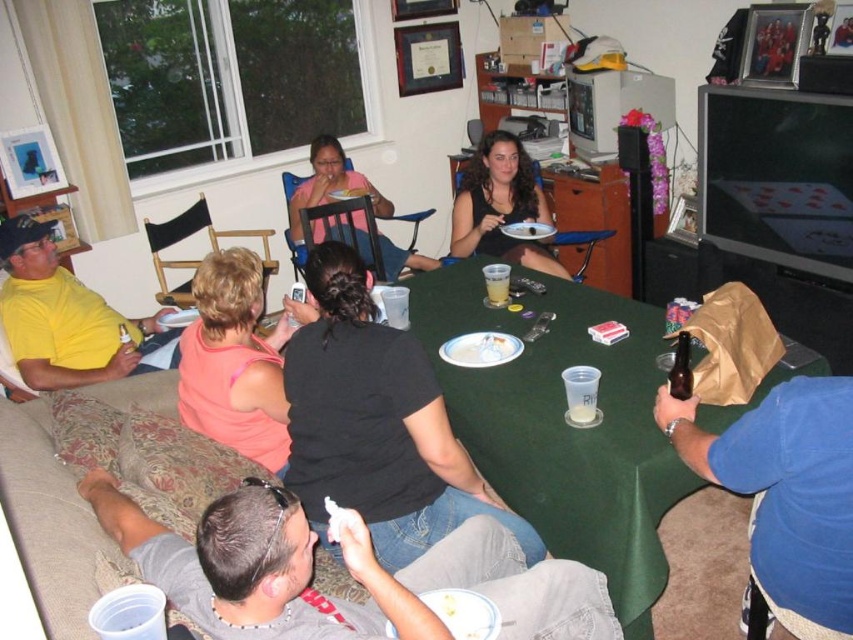
Question: Considering the real-world distances, which object is farthest from the green fabric table at center?

Choices:
 (A) black matte shirt at center
 (B) blue fabric bag at lower right
 (C) pink matte shirt at upper center
 (D) yellow matte shirt at left

Answer: (C)

Question: Is black matte shirt at center to the left of blue fabric bag at lower right from the viewer's perspective?

Choices:
 (A) no
 (B) yes

Answer: (B)

Question: Which of the following is the farthest from the observer?

Choices:
 (A) blue fabric bag at lower right
 (B) yellow matte shirt at left
 (C) pink fabric shirt at center
 (D) green fabric table at center

Answer: (B)

Question: Can you confirm if green fabric table at center is positioned below black fabric shirt at center?

Choices:
 (A) yes
 (B) no

Answer: (A)

Question: Can you confirm if green fabric table at center is bigger than pink fabric shirt at center?

Choices:
 (A) no
 (B) yes

Answer: (B)

Question: Which point is farther from the camera taking this photo?

Choices:
 (A) tap(202, 289)
 (B) tap(456, 268)
 (C) tap(506, 216)
 (D) tap(96, 300)

Answer: (C)